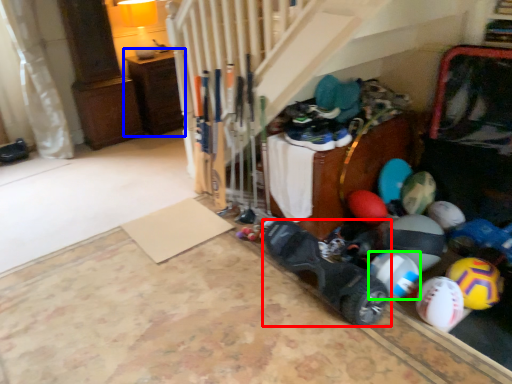
Question: Based on their relative distances, which object is nearer to footwear (highlighted by a red box)? Choose from furniture (highlighted by a blue box) and beach ball (highlighted by a green box).

Choices:
 (A) furniture
 (B) beach ball

Answer: (B)